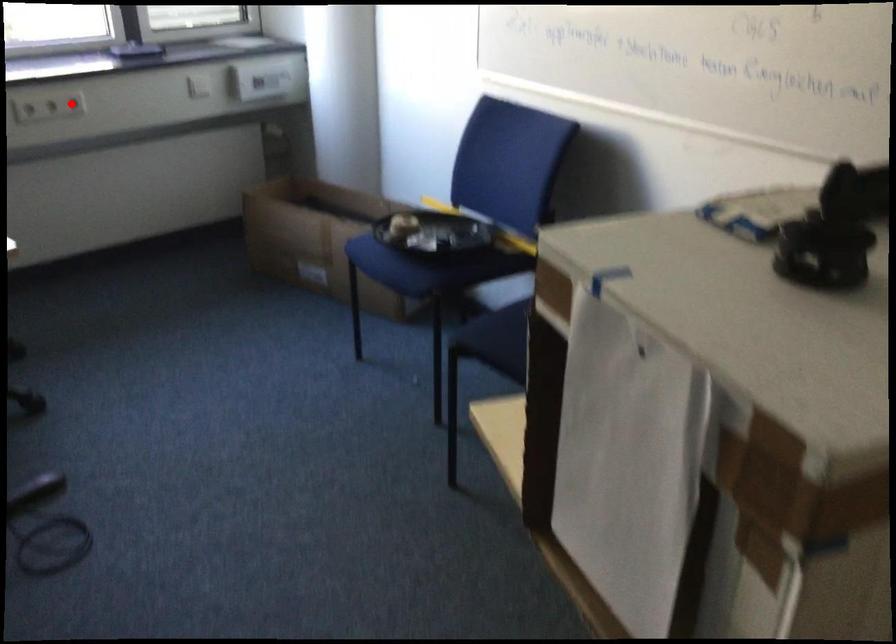
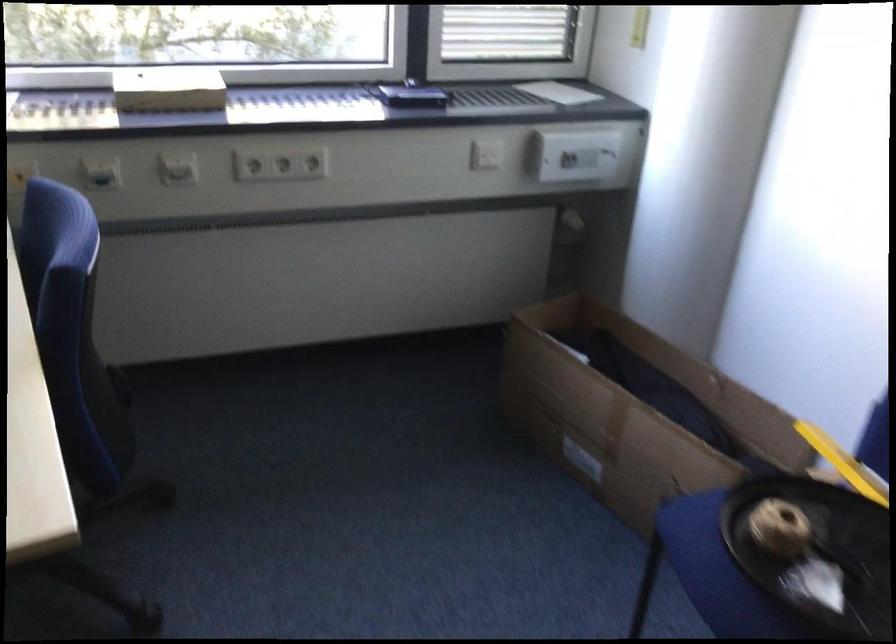
Where in the second image is the point corresponding to the highlighted location from the first image?

(313, 163)